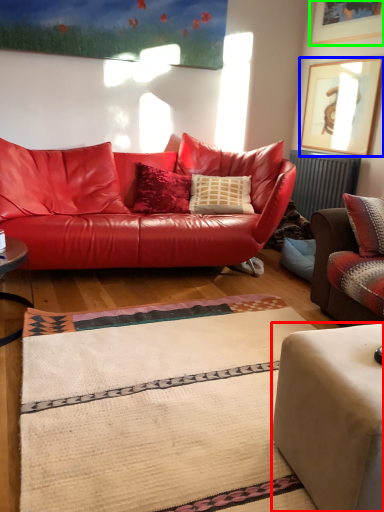
Question: Estimate the real-world distances between objects in this image. Which object is closer to studio couch (highlighted by a red box), picture frame (highlighted by a blue box) or picture frame (highlighted by a green box)?

Choices:
 (A) picture frame
 (B) picture frame

Answer: (A)